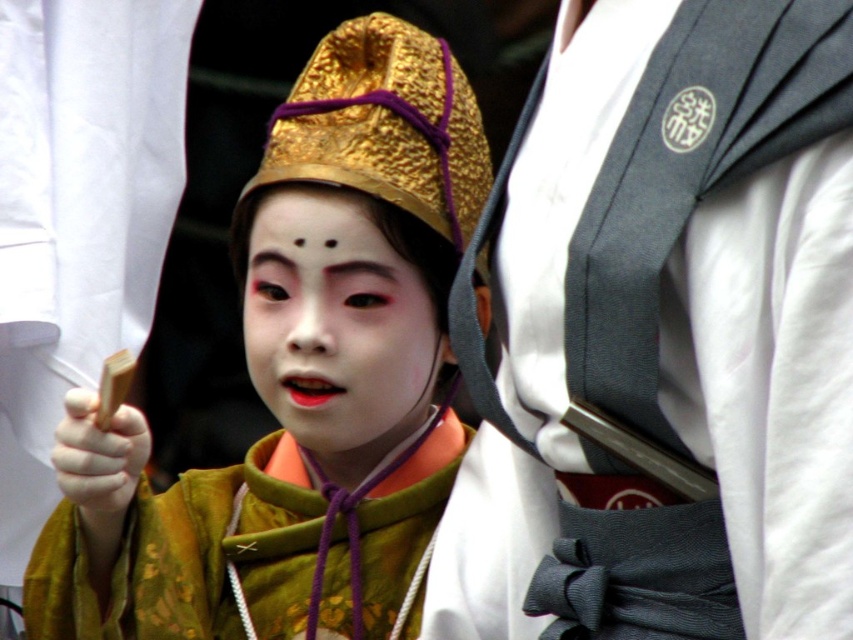
Question: Is silky white kimono at center to the right of matte gold crown at center from the viewer's perspective?

Choices:
 (A) no
 (B) yes

Answer: (B)

Question: In this image, where is silky white kimono at center located relative to matte gold face at center?

Choices:
 (A) left
 (B) right

Answer: (B)

Question: Which of the following is the closest to the observer?

Choices:
 (A) silky white kimono at center
 (B) matte gold face at center

Answer: (A)

Question: Which point is closer to the camera?

Choices:
 (A) coord(345,268)
 (B) coord(706,188)

Answer: (B)

Question: Can you confirm if silky white kimono at center is thinner than matte gold face at center?

Choices:
 (A) yes
 (B) no

Answer: (B)

Question: Which object appears farthest from the camera in this image?

Choices:
 (A) silky white kimono at center
 (B) matte gold face at center
 (C) matte gold crown at center

Answer: (C)